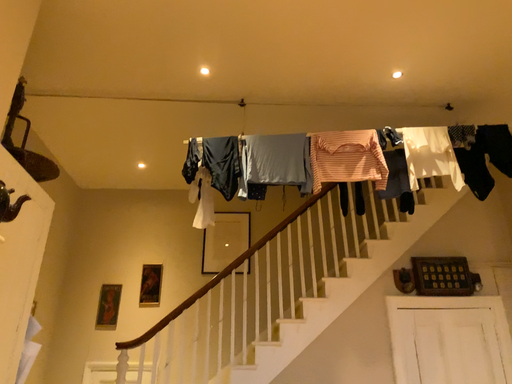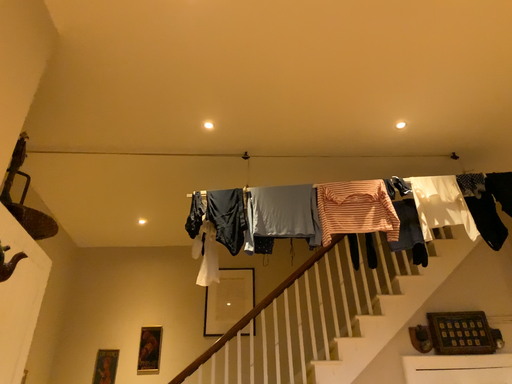
Question: How did the camera likely rotate when shooting the video?

Choices:
 (A) rotated upward
 (B) rotated downward

Answer: (A)